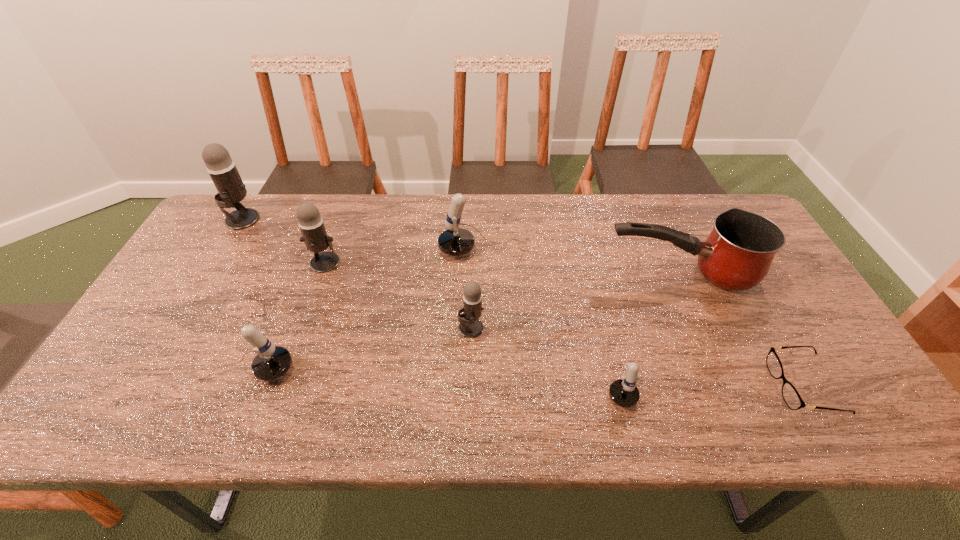
Identify the location of object at the far left corner. This screenshot has width=960, height=540. coord(222,169).

At what (x,y) coordinates should I click in order to perform the action: click on object located at the near right corner. Please return your answer as a coordinate pair (x, y). Looking at the image, I should click on (793, 400).

Locate an element on the screen. The height and width of the screenshot is (540, 960). free spot at the far edge of the desktop is located at coordinates (300, 230).

The width and height of the screenshot is (960, 540). I want to click on vacant region at the right edge of the desktop, so click(x=788, y=327).

Where is `vacant area at the near left corner of the desktop`? The image size is (960, 540). vacant area at the near left corner of the desktop is located at coordinates (139, 419).

The height and width of the screenshot is (540, 960). Find the location of `free space at the far right corner of the desktop`. free space at the far right corner of the desktop is located at coordinates (708, 230).

Image resolution: width=960 pixels, height=540 pixels. I want to click on free spot between the second farthest gray microphone and the second white microphone from left to right, so click(404, 256).

The image size is (960, 540). What are the coordinates of `blank region between the saucepan and the biggest white microphone` in the screenshot? It's located at (581, 262).

Where is `free space between the rightmost white microphone and the tallest object`? The image size is (960, 540). free space between the rightmost white microphone and the tallest object is located at coordinates (430, 299).

Image resolution: width=960 pixels, height=540 pixels. I want to click on free space that is in between the second smallest gray microphone and the saucepan, so click(502, 268).